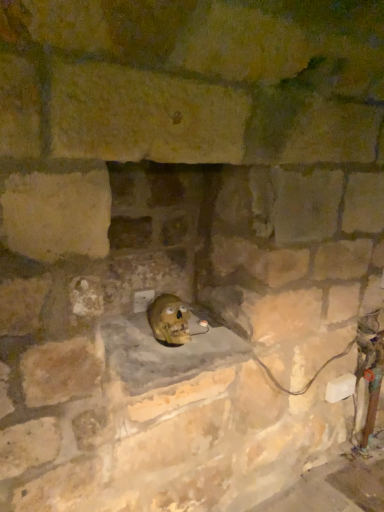
At what (x,y) coordinates should I click in order to perform the action: click on free space on the front side of yellow matte skull at center. Please return your answer as a coordinate pair (x, y). The image size is (384, 512). Looking at the image, I should click on (157, 362).